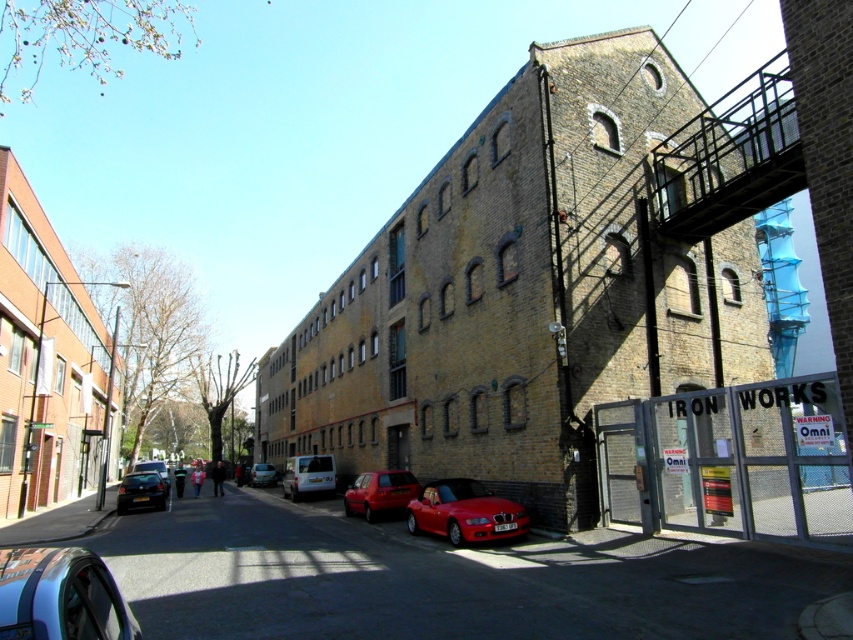
Question: Does metallic red car at center come behind white matte van at center?

Choices:
 (A) yes
 (B) no

Answer: (B)

Question: Can you confirm if metallic red car at center is bigger than matte red van at center?

Choices:
 (A) yes
 (B) no

Answer: (A)

Question: Estimate the real-world distances between objects in this image. Which object is farther from the metallic silver van at center?

Choices:
 (A) shiny red car at center
 (B) white matte van at center

Answer: (A)

Question: Is shiny red car at center further to the viewer compared to metallic silver van at center?

Choices:
 (A) yes
 (B) no

Answer: (B)

Question: Which of the following is the closest to the observer?

Choices:
 (A) shiny blue car at lower left
 (B) shiny black car at lower left

Answer: (A)

Question: Estimate the real-world distances between objects in this image. Which object is farther from the matte red van at center?

Choices:
 (A) shiny blue car at lower left
 (B) shiny black car at lower left
 (C) shiny red car at center

Answer: (A)